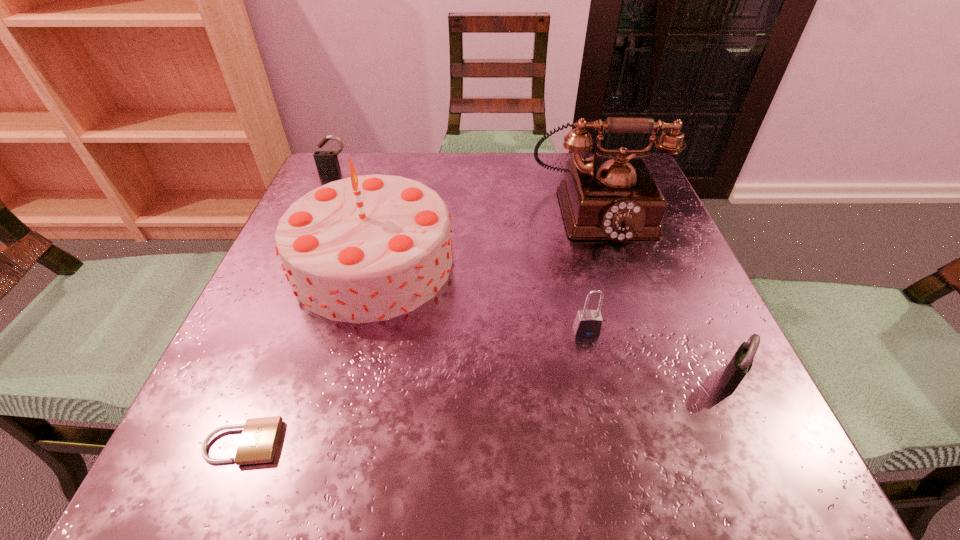
Where is `padlock identified as the third closest to the birthday cake`? padlock identified as the third closest to the birthday cake is located at coordinates (588, 323).

This screenshot has width=960, height=540. Identify the location of free spot that satisfies the following two spatial constraints: 1. on the shackle of the second padlock from right to left; 2. on the right side of the second nearest object. (597, 377).

Where is `vacant region that satisfies the following two spatial constraints: 1. with the keyhole on the front of the farthest padlock; 2. on the right side of the nearest object`? The width and height of the screenshot is (960, 540). vacant region that satisfies the following two spatial constraints: 1. with the keyhole on the front of the farthest padlock; 2. on the right side of the nearest object is located at coordinates (211, 443).

Locate an element on the screen. This screenshot has height=540, width=960. free space that satisfies the following two spatial constraints: 1. with the keyhole on the front of the birthday cake; 2. on the left side of the farthest object is located at coordinates (293, 263).

I want to click on free location that satisfies the following two spatial constraints: 1. with the keyhole on the front of the farthest padlock; 2. on the left side of the shortest object, so click(211, 443).

Identify the location of free region that satisfies the following two spatial constraints: 1. with the keyhole on the front of the third farthest padlock; 2. on the right side of the farthest padlock. [241, 377].

Locate an element on the screen. blank space that satisfies the following two spatial constraints: 1. with the keyhole on the front of the farthest padlock; 2. on the right side of the rightmost padlock is located at coordinates (241, 377).